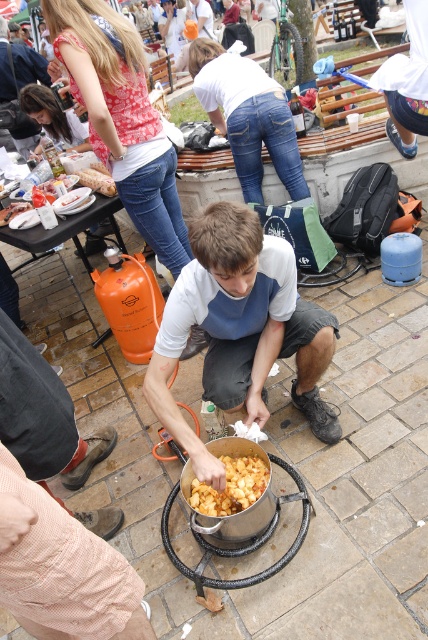
You are a photographer standing at the edge of the event area. You want to capture a photo of the matte white shirt at center and the golden crispy chips at center without any obstruction. Based on their positions, which object is closer to the camera and should be in focus first?

The matte white shirt at center is wider than golden crispy chips at center, so it is closer to the camera and should be focused on first to ensure clarity in the photo.

What is located at the coordinates point [240,328] in the image?

The matte white shirt at center is located at point [240,328].